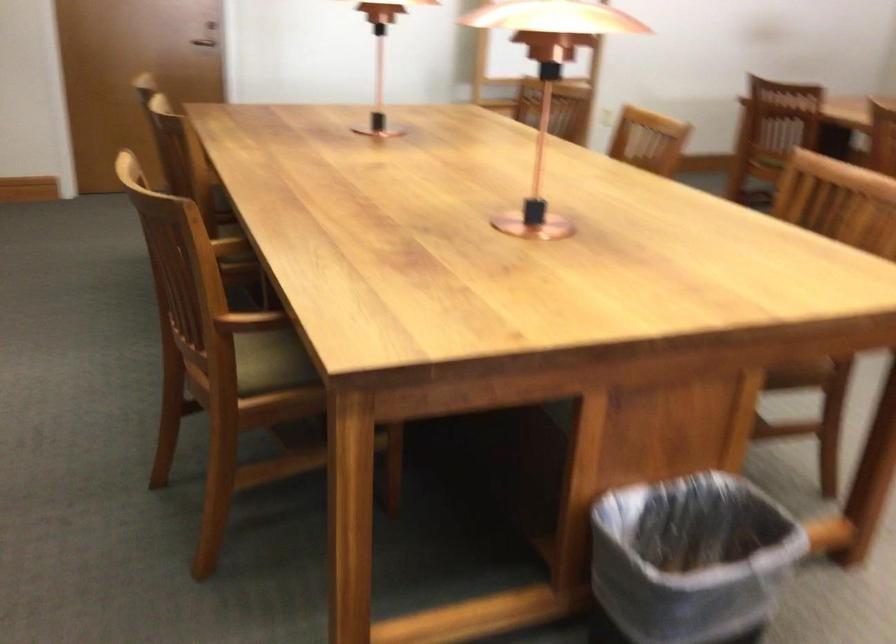
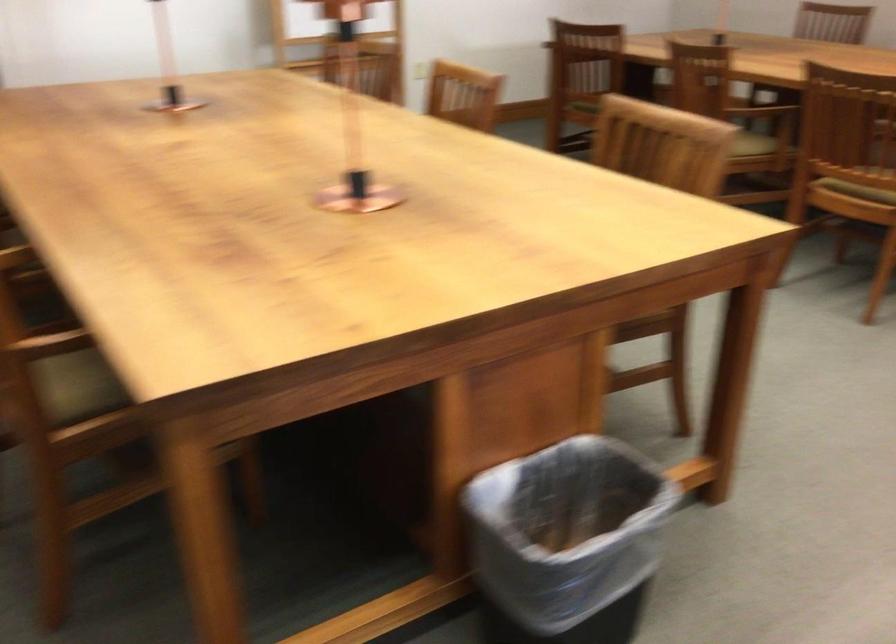
Question: The images are taken continuously from a first-person perspective. In which direction are you moving?

Choices:
 (A) Left
 (B) Right
 (C) Forward
 (D) Backward

Answer: (C)